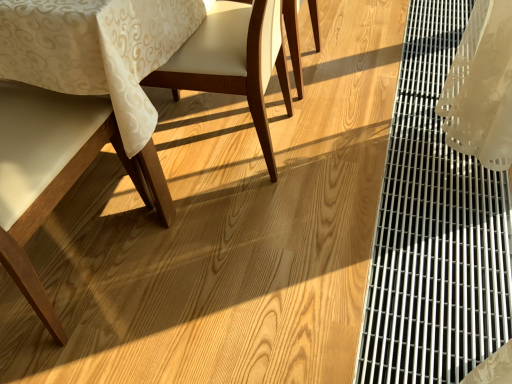
Question: Can you confirm if matte wood chair at center, the second chair when ordered from right to left, is smaller than matte white chair at left, which appears as the fourth chair when viewed from the right?

Choices:
 (A) yes
 (B) no

Answer: (A)

Question: Does matte wood chair at center, the second chair when ordered from right to left, appear on the left side of matte white chair at left, which appears as the fourth chair when viewed from the right?

Choices:
 (A) yes
 (B) no

Answer: (B)

Question: Is matte wood chair at center, the second chair when ordered from right to left, positioned far away from matte white chair at left, which ranks as the first chair in left-to-right order?

Choices:
 (A) yes
 (B) no

Answer: (B)

Question: Does matte wood chair at center, the second chair when ordered from right to left, lie in front of matte white chair at left, which appears as the fourth chair when viewed from the right?

Choices:
 (A) no
 (B) yes

Answer: (A)

Question: Considering the relative sizes of matte wood chair at center, the second chair when ordered from right to left, and matte white chair at left, which ranks as the first chair in left-to-right order, in the image provided, is matte wood chair at center, the second chair when ordered from right to left, bigger than matte white chair at left, which ranks as the first chair in left-to-right order,?

Choices:
 (A) yes
 (B) no

Answer: (B)

Question: Is metallic grid at right bigger or smaller than matte white chair at left, which appears as the fourth chair when viewed from the right?

Choices:
 (A) big
 (B) small

Answer: (B)

Question: From a real-world perspective, is metallic grid at right positioned above or below matte white chair at left, which ranks as the first chair in left-to-right order?

Choices:
 (A) below
 (B) above

Answer: (A)

Question: Is point (444, 317) positioned closer to the camera than point (29, 294)?

Choices:
 (A) closer
 (B) farther

Answer: (B)

Question: Considering their positions, is metallic grid at right located in front of or behind matte white chair at left, which ranks as the first chair in left-to-right order?

Choices:
 (A) front
 (B) behind

Answer: (B)

Question: Is matte white chair at left, which ranks as the first chair in left-to-right order, inside the boundaries of wooden chair at center, positioned as the first chair in right-to-left order, or outside?

Choices:
 (A) outside
 (B) inside

Answer: (A)

Question: In the image, is matte white chair at left, which appears as the fourth chair when viewed from the right, on the left side or the right side of wooden chair at center, acting as the 4th chair starting from the left?

Choices:
 (A) right
 (B) left

Answer: (B)

Question: Based on their sizes in the image, would you say matte white chair at left, which appears as the fourth chair when viewed from the right, is bigger or smaller than wooden chair at center, acting as the 4th chair starting from the left?

Choices:
 (A) big
 (B) small

Answer: (A)

Question: Is matte white chair at left, which appears as the fourth chair when viewed from the right, taller or shorter than wooden chair at center, positioned as the first chair in right-to-left order?

Choices:
 (A) short
 (B) tall

Answer: (B)

Question: Is matte white chair at left, which ranks as the first chair in left-to-right order, bigger or smaller than matte wood chair at center, which appears as the 3th chair when viewed from the left?

Choices:
 (A) small
 (B) big

Answer: (B)

Question: From a real-world perspective, is matte white chair at left, which ranks as the first chair in left-to-right order, positioned above or below matte wood chair at center, which appears as the 3th chair when viewed from the left?

Choices:
 (A) above
 (B) below

Answer: (A)